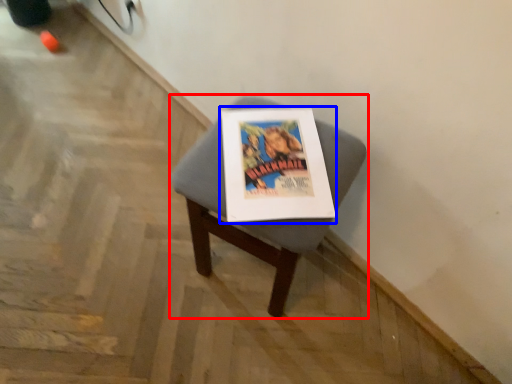
Question: Among these objects, which one is farthest to the camera, furniture (highlighted by a red box) or magazine (highlighted by a blue box)?

Choices:
 (A) furniture
 (B) magazine

Answer: (B)